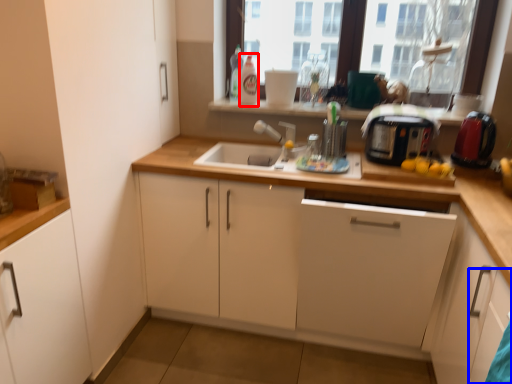
Question: Among these objects, which one is farthest to the camera, bottle (highlighted by a red box) or cabinetry (highlighted by a blue box)?

Choices:
 (A) bottle
 (B) cabinetry

Answer: (A)